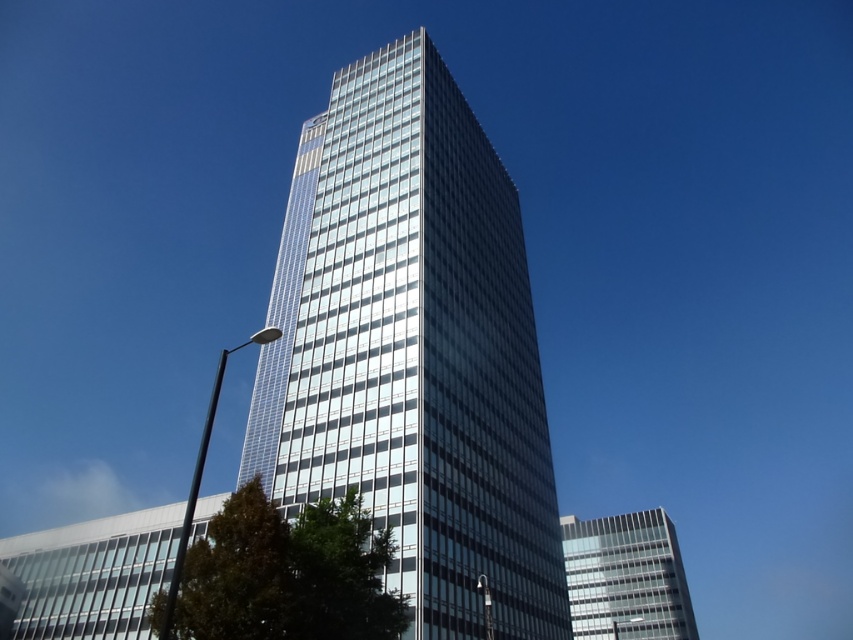
Is transparent glass tower at center to the left of clear glass building at lower right from the viewer's perspective?

Indeed, transparent glass tower at center is positioned on the left side of clear glass building at lower right.

Who is more distant from viewer, (379, 371) or (633, 608)?

Point (633, 608)

Image resolution: width=853 pixels, height=640 pixels. Find the location of `transparent glass tower at center`. transparent glass tower at center is located at coordinates (413, 352).